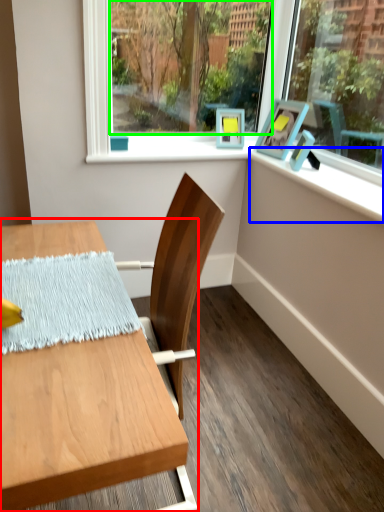
Question: Based on their relative distances, which object is nearer to table (highlighted by a red box)? Choose from window sill (highlighted by a blue box) and window screen (highlighted by a green box).

Choices:
 (A) window sill
 (B) window screen

Answer: (A)